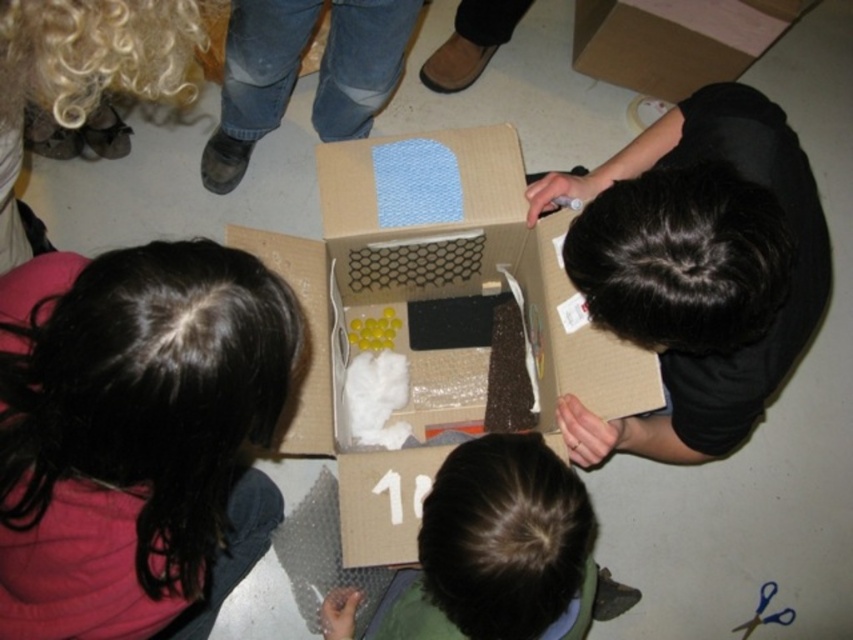
The image size is (853, 640). What do you see at coordinates (129, 428) in the screenshot?
I see `dark brown hair at upper left` at bounding box center [129, 428].

Is dark brown hair at upper left taller than cardboard box at center?

No, dark brown hair at upper left is not taller than cardboard box at center.

Locate an element on the screen. The image size is (853, 640). dark brown hair at upper left is located at coordinates (129, 428).

The image size is (853, 640). Describe the element at coordinates (129, 428) in the screenshot. I see `dark brown hair at upper left` at that location.

Is dark brown hair at upper left wider than brown fuzzy hair at lower center?

Incorrect, dark brown hair at upper left's width does not surpass brown fuzzy hair at lower center's.

Measure the distance between dark brown hair at upper left and camera.

A distance of 55.71 centimeters exists between dark brown hair at upper left and camera.

This screenshot has width=853, height=640. In order to click on dark brown hair at upper left in this screenshot , I will do `click(129, 428)`.

Consider the image. Is dark brown hair at upper left above jeans at center?

Actually, dark brown hair at upper left is below jeans at center.

Between dark brown hair at upper left and jeans at center, which one is positioned higher?

jeans at center is above.

Is point (167, 572) farther from viewer compared to point (351, 132)?

No, it is in front of (351, 132).

I want to click on dark brown hair at upper left, so (x=129, y=428).